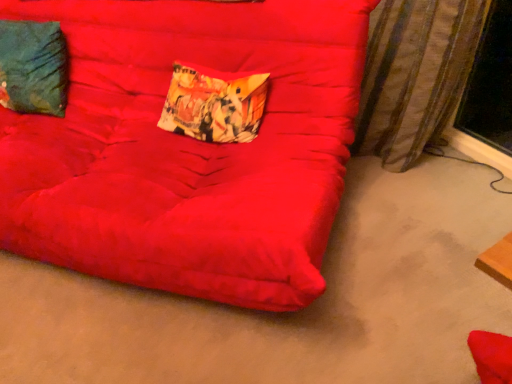
Question: Can you confirm if suede-like red futon at center is taller than printed fabric pillow at center, arranged as the second pillow when viewed from the left?

Choices:
 (A) no
 (B) yes

Answer: (B)

Question: From the image's perspective, is suede-like red futon at center located above printed fabric pillow at center, arranged as the second pillow when viewed from the left?

Choices:
 (A) no
 (B) yes

Answer: (A)

Question: Is suede-like red futon at center beside printed fabric pillow at center, arranged as the second pillow when viewed from the left?

Choices:
 (A) no
 (B) yes

Answer: (A)

Question: Is printed fabric pillow at center, arranged as the second pillow when viewed from the left, completely or partially inside suede-like red futon at center?

Choices:
 (A) no
 (B) yes

Answer: (B)

Question: Is suede-like red futon at center shorter than printed fabric pillow at center, which is the 1th pillow from right to left?

Choices:
 (A) yes
 (B) no

Answer: (B)

Question: Considering their positions, is printed fabric pillow at center, arranged as the second pillow when viewed from the left, located in front of or behind teal fabric pillow at upper left, the 2th pillow positioned from the right?

Choices:
 (A) front
 (B) behind

Answer: (A)

Question: Visually, is printed fabric pillow at center, which is the 1th pillow from right to left, positioned to the left or to the right of teal fabric pillow at upper left, arranged as the 1th pillow when viewed from the left?

Choices:
 (A) left
 (B) right

Answer: (B)

Question: Which is correct: printed fabric pillow at center, which is the 1th pillow from right to left, is inside teal fabric pillow at upper left, the 2th pillow positioned from the right, or outside of it?

Choices:
 (A) inside
 (B) outside

Answer: (B)

Question: From the image's perspective, relative to teal fabric pillow at upper left, arranged as the 1th pillow when viewed from the left, is printed fabric pillow at center, arranged as the second pillow when viewed from the left, above or below?

Choices:
 (A) below
 (B) above

Answer: (A)

Question: Considering their positions, is suede-like red futon at center located in front of or behind striped fabric curtain at right?

Choices:
 (A) behind
 (B) front

Answer: (B)

Question: Is point (241, 190) positioned closer to the camera than point (415, 140)?

Choices:
 (A) farther
 (B) closer

Answer: (B)

Question: Considering the positions of suede-like red futon at center and striped fabric curtain at right in the image, is suede-like red futon at center wider or thinner than striped fabric curtain at right?

Choices:
 (A) thin
 (B) wide

Answer: (B)

Question: From their relative heights in the image, would you say suede-like red futon at center is taller or shorter than striped fabric curtain at right?

Choices:
 (A) tall
 (B) short

Answer: (A)

Question: From the image's perspective, is striped fabric curtain at right positioned above or below teal fabric pillow at upper left, the 2th pillow positioned from the right?

Choices:
 (A) above
 (B) below

Answer: (B)

Question: Is point (400, 39) closer or farther from the camera than point (48, 66)?

Choices:
 (A) farther
 (B) closer

Answer: (A)